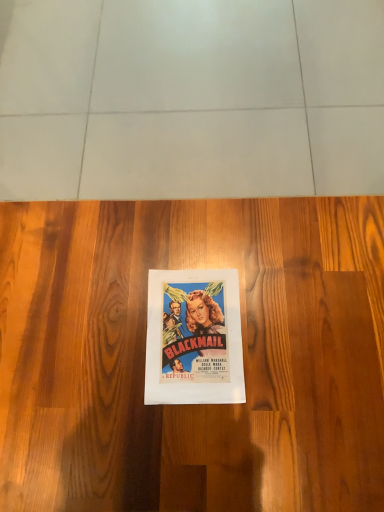
You are a GUI agent. You are given a task and a screenshot of the screen. Output one action in this format:
    pyautogui.click(x=<x>, y=<y>)
    Task: Click on the vacant area to the left of matte paper poster at center
    This screenshot has height=512, width=384.
    Given the screenshot: What is the action you would take?
    tap(98, 343)